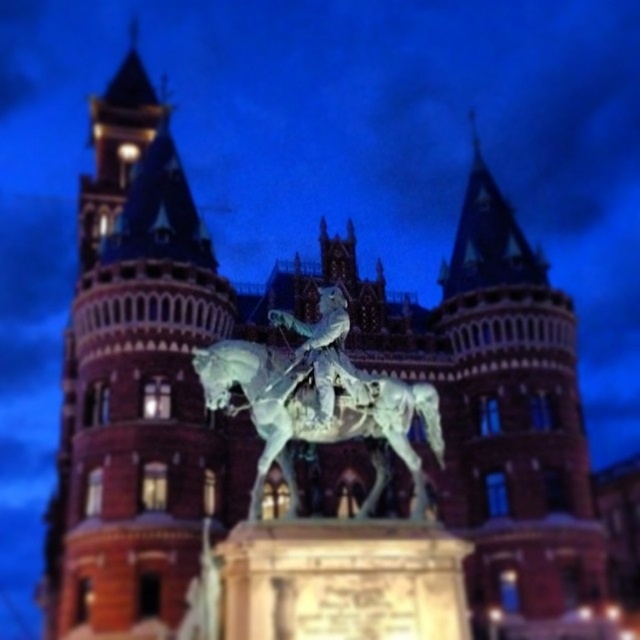
Does red brick tower at center have a smaller size compared to polished bronze statue at center?

Actually, red brick tower at center might be larger than polished bronze statue at center.

Does red brick tower at center appear on the left side of polished bronze statue at center?

Correct, you'll find red brick tower at center to the left of polished bronze statue at center.

Identify the location of red brick tower at center. This screenshot has width=640, height=640. (134, 384).

Where is `red brick tower at center`? red brick tower at center is located at coordinates (134, 384).

Which is below, polished bronze horse at center or polished bronze statue at center?

polished bronze horse at center

Based on the photo, who is more forward, (x=356, y=410) or (x=330, y=385)?

Point (x=330, y=385) is more forward.

This screenshot has width=640, height=640. I want to click on polished bronze horse at center, so click(314, 412).

Does red brick tower at center appear on the right side of polished bronze horse at center?

Incorrect, red brick tower at center is not on the right side of polished bronze horse at center.

Is point (188, 541) in front of point (378, 381)?

No, (188, 541) is behind (378, 381).

Find the location of `red brick tower at center`. red brick tower at center is located at coordinates (134, 384).